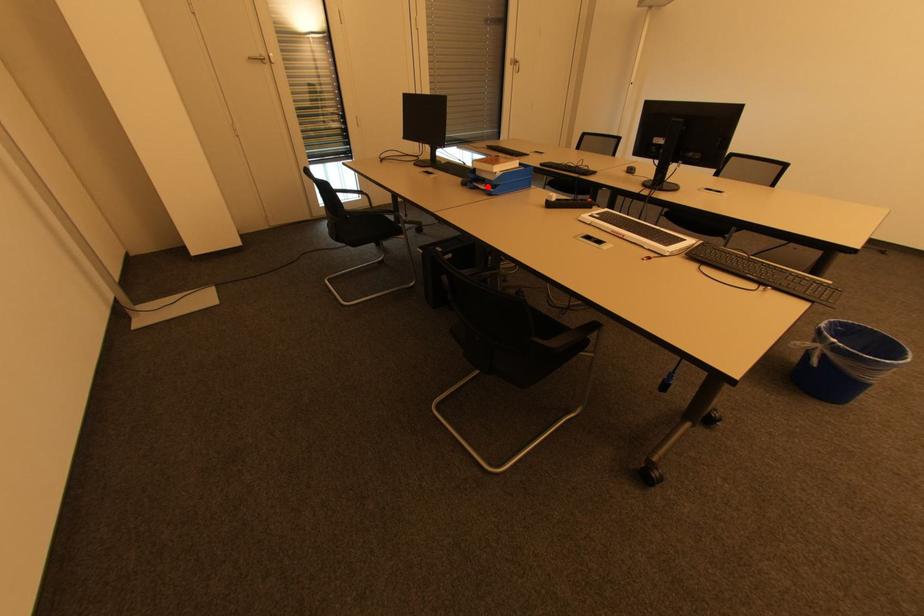
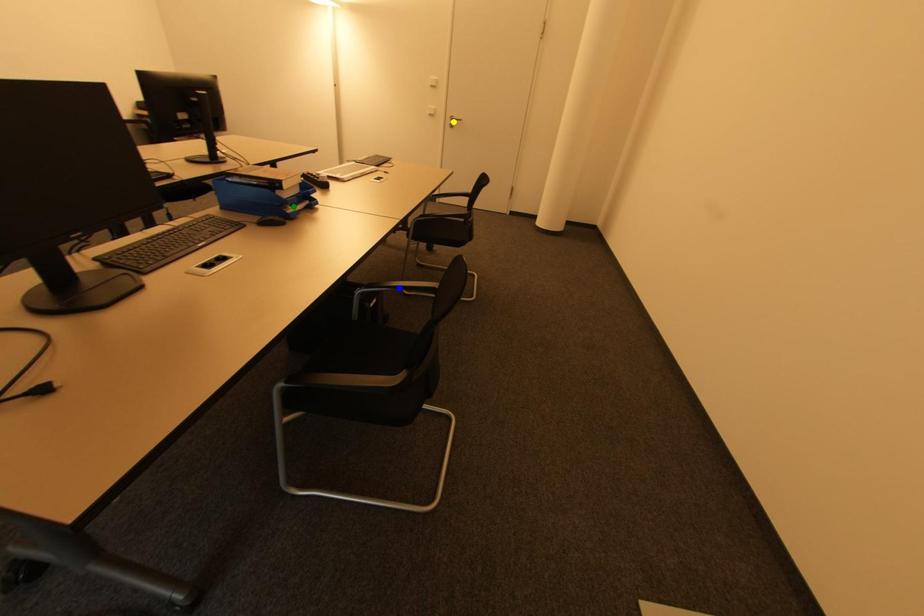
Question: I am providing you with two images of the same scene from different viewpoints. A red point is marked on the first image. You are given multiple points on the second image. Which point in image 2 is actually the same real-world point as the red point in image 1?

Choices:
 (A) blue point
 (B) yellow point
 (C) green point

Answer: (C)